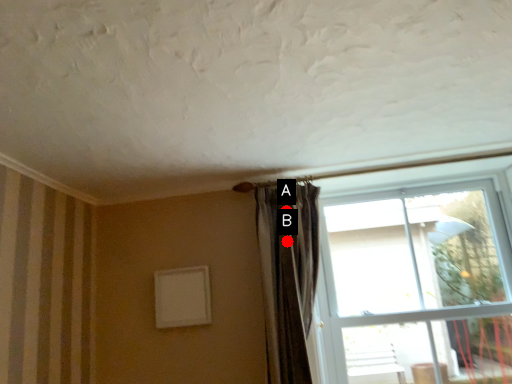
Question: Two points are circled on the image, labeled by A and B beside each circle. Which point is further to the camera?

Choices:
 (A) A is further
 (B) B is further

Answer: (A)